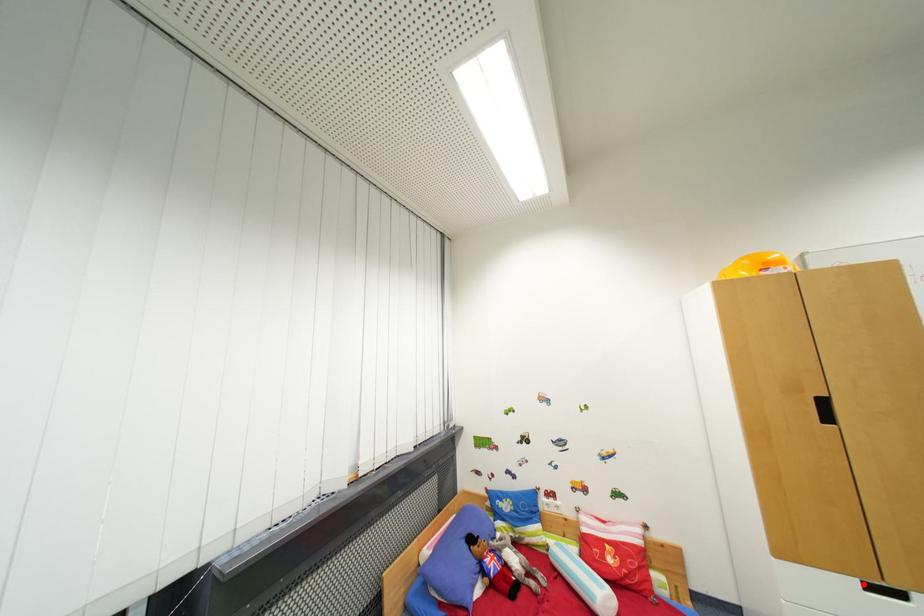
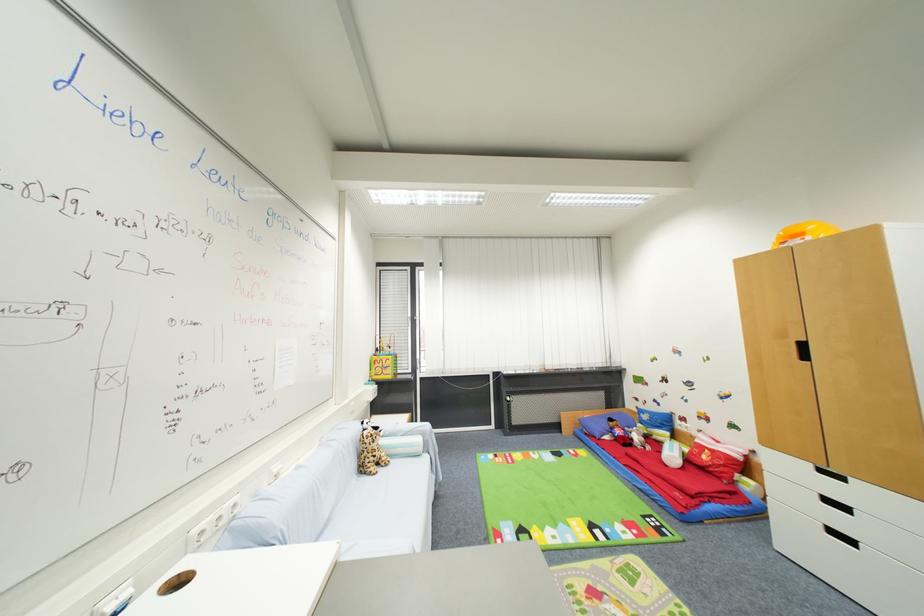
Question: I am providing you with two images of the same scene from different viewpoints. In image1, a red point is highlighted. Considering the same 3D point in image2, which of the following is correct?

Choices:
 (A) It is closer
 (B) It is farther

Answer: (B)